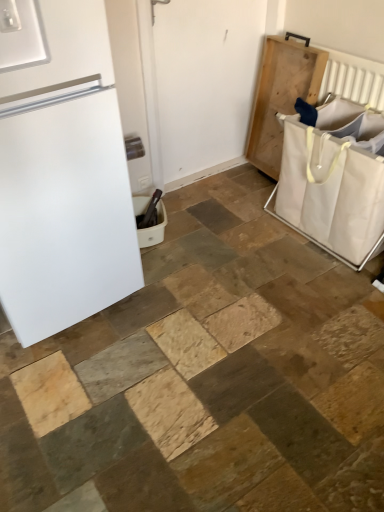
Question: Does white matte refrigerator at left have a larger size compared to natural wood tray at right?

Choices:
 (A) no
 (B) yes

Answer: (B)

Question: From a real-world perspective, is white matte refrigerator at left over natural wood tray at right?

Choices:
 (A) no
 (B) yes

Answer: (B)

Question: Does white matte refrigerator at left appear on the left side of natural wood tray at right?

Choices:
 (A) no
 (B) yes

Answer: (B)

Question: Does white matte refrigerator at left touch natural wood tray at right?

Choices:
 (A) yes
 (B) no

Answer: (B)

Question: From a real-world perspective, is white matte refrigerator at left below natural wood tray at right?

Choices:
 (A) yes
 (B) no

Answer: (B)

Question: Based on their positions, is natural wood tray at right located to the left or right of white canvas laundry basket at right, which ranks as the 1th laundry basket in right-to-left order?

Choices:
 (A) left
 (B) right

Answer: (A)

Question: Looking at the image, does natural wood tray at right seem bigger or smaller compared to white canvas laundry basket at right, which ranks as the 1th laundry basket in right-to-left order?

Choices:
 (A) big
 (B) small

Answer: (B)

Question: Is point (261, 87) positioned closer to the camera than point (319, 199)?

Choices:
 (A) closer
 (B) farther

Answer: (B)

Question: Do you think natural wood tray at right is within white canvas laundry basket at right, arranged as the second laundry basket when viewed from the left, or outside of it?

Choices:
 (A) inside
 (B) outside

Answer: (B)

Question: From a real-world perspective, relative to white matte refrigerator at left, is white canvas laundry basket at right, arranged as the second laundry basket when viewed from the left, vertically above or below?

Choices:
 (A) below
 (B) above

Answer: (A)

Question: Considering the positions of white canvas laundry basket at right, arranged as the second laundry basket when viewed from the left, and white matte refrigerator at left in the image, is white canvas laundry basket at right, arranged as the second laundry basket when viewed from the left, taller or shorter than white matte refrigerator at left?

Choices:
 (A) tall
 (B) short

Answer: (B)

Question: Considering the positions of white canvas laundry basket at right, which ranks as the 1th laundry basket in right-to-left order, and white matte refrigerator at left in the image, is white canvas laundry basket at right, which ranks as the 1th laundry basket in right-to-left order, wider or thinner than white matte refrigerator at left?

Choices:
 (A) wide
 (B) thin

Answer: (B)

Question: Is point (321, 137) positioned closer to the camera than point (64, 161)?

Choices:
 (A) closer
 (B) farther

Answer: (B)

Question: Considering the positions of white plastic laundry basket at lower center, marked as the 2th laundry basket in a right-to-left arrangement, and white canvas laundry basket at right, which ranks as the 1th laundry basket in right-to-left order, in the image, is white plastic laundry basket at lower center, marked as the 2th laundry basket in a right-to-left arrangement, wider or thinner than white canvas laundry basket at right, which ranks as the 1th laundry basket in right-to-left order,?

Choices:
 (A) thin
 (B) wide

Answer: (A)

Question: Based on their sizes in the image, would you say white plastic laundry basket at lower center, placed as the 1th laundry basket when sorted from left to right, is bigger or smaller than white canvas laundry basket at right, which ranks as the 1th laundry basket in right-to-left order?

Choices:
 (A) big
 (B) small

Answer: (B)